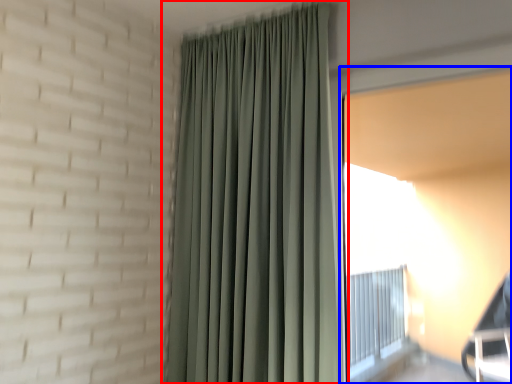
Question: Among these objects, which one is farthest to the camera, curtain (highlighted by a red box) or window screen (highlighted by a blue box)?

Choices:
 (A) curtain
 (B) window screen

Answer: (A)